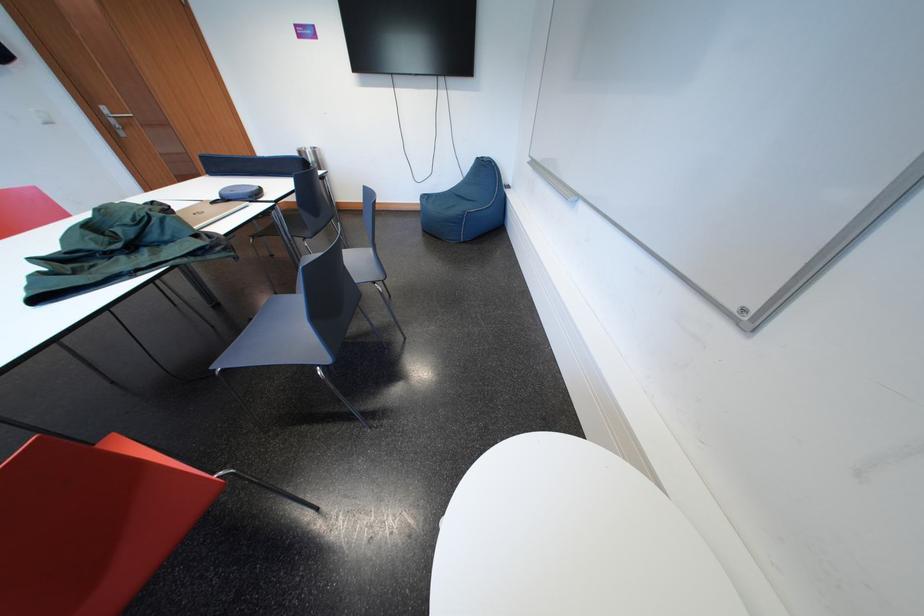
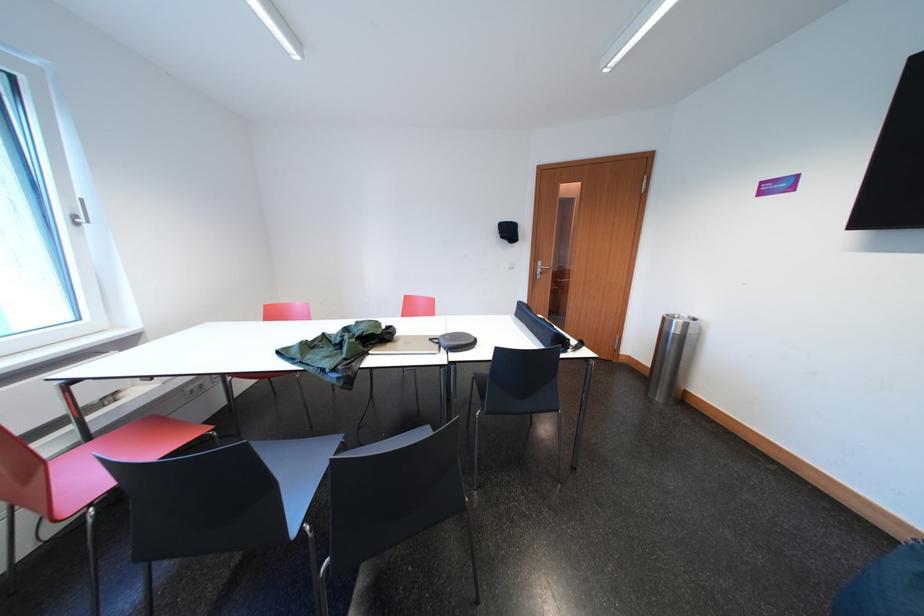
The point at [107,215] is marked in the first image. Where is the corresponding point in the second image?

(367, 326)